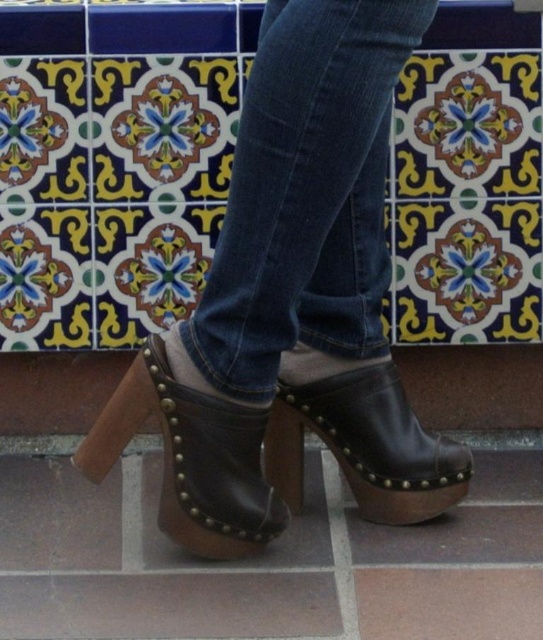
Who is more forward, (313, 346) or (438, 499)?

Point (438, 499) is in front.

Which is behind, point (325, 179) or point (363, 499)?

Positioned behind is point (363, 499).

Locate an element on the screen. This screenshot has height=640, width=543. brown leather clogs at center is located at coordinates point(292,298).

Who is more distant from viewer, (392, 32) or (194, 438)?

The point (194, 438) is behind.

Who is more distant from viewer, (x=258, y=308) or (x=252, y=484)?

The point (x=252, y=484) is more distant.

I want to click on denim at center, so click(x=306, y=195).

Which of these two, brown leather clogs at center or denim at center, stands shorter?

denim at center is shorter.

Where is `brown leather clogs at center`? brown leather clogs at center is located at coordinates (292, 298).